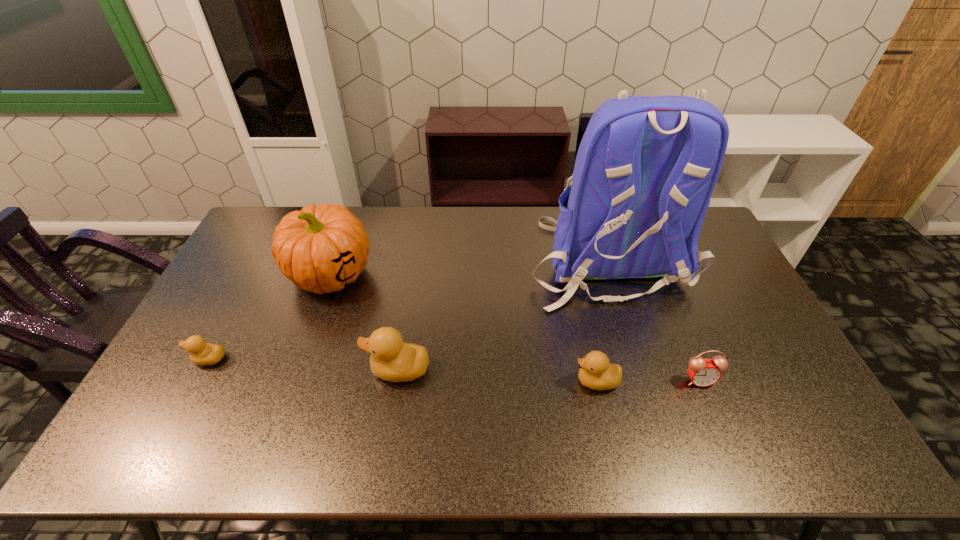
Where is `vacant space that is in between the second duckling from left to right and the fifth shortest object`? This screenshot has height=540, width=960. vacant space that is in between the second duckling from left to right and the fifth shortest object is located at coordinates (365, 322).

Where is `unoccupied position between the alarm clock and the tallest object`? unoccupied position between the alarm clock and the tallest object is located at coordinates (654, 320).

Find the location of a particular element. This screenshot has width=960, height=540. free space between the third tallest object and the leftmost duckling is located at coordinates (303, 364).

Find the location of a particular element. The width and height of the screenshot is (960, 540). free space between the alarm clock and the rightmost duckling is located at coordinates (648, 381).

Image resolution: width=960 pixels, height=540 pixels. In order to click on free space that is in between the alarm clock and the backpack in this screenshot , I will do `click(654, 320)`.

The image size is (960, 540). I want to click on vacant space that's between the shortest duckling and the alarm clock, so click(454, 370).

Identify which object is the fifth nearest to the tallest object. Please provide its 2D coordinates. Your answer should be formatted as a tuple, i.e. [(x, y)], where the tuple contains the x and y coordinates of a point satisfying the conditions above.

[(201, 353)]

Locate which object ranks in proximity to the alarm clock. Please provide its 2D coordinates. Your answer should be formatted as a tuple, i.e. [(x, y)], where the tuple contains the x and y coordinates of a point satisfying the conditions above.

[(595, 372)]

Select which duckling appears as the closest to the backpack. Please provide its 2D coordinates. Your answer should be formatted as a tuple, i.e. [(x, y)], where the tuple contains the x and y coordinates of a point satisfying the conditions above.

[(595, 372)]

Select which duckling appears as the third closest to the backpack. Please provide its 2D coordinates. Your answer should be formatted as a tuple, i.e. [(x, y)], where the tuple contains the x and y coordinates of a point satisfying the conditions above.

[(201, 353)]